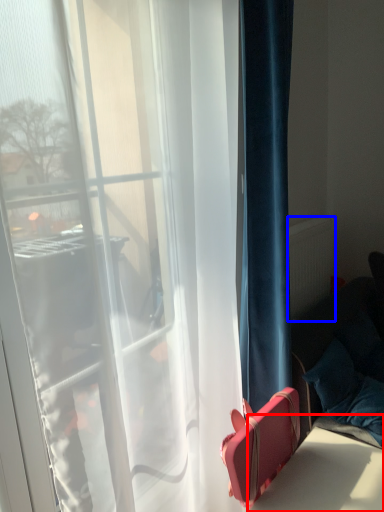
Question: Among these objects, which one is farthest to the camera, table (highlighted by a red box) or radiator (highlighted by a blue box)?

Choices:
 (A) table
 (B) radiator

Answer: (B)